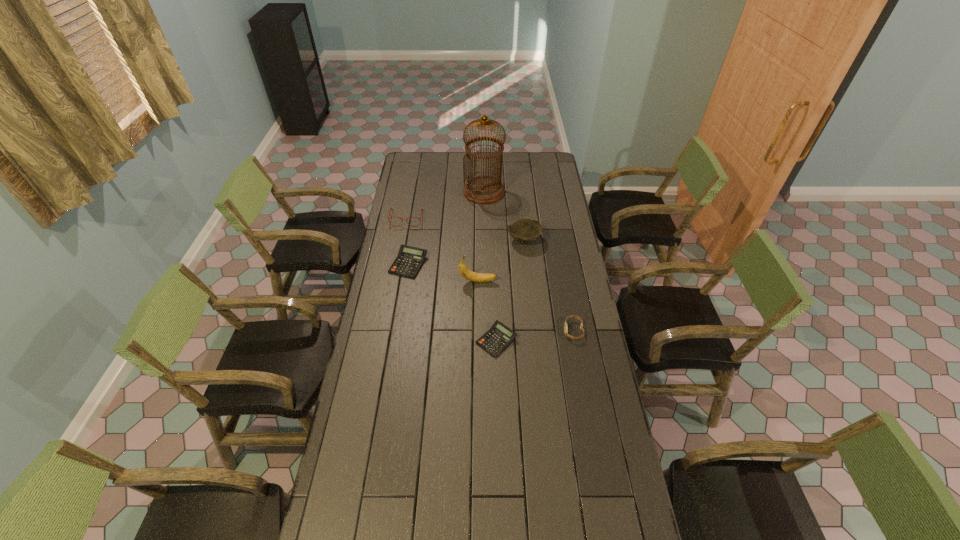
What are the coordinates of `calculator situated at the left edge` in the screenshot? It's located at (409, 260).

Find the location of a particular element. The height and width of the screenshot is (540, 960). spectacles that is at the left edge is located at coordinates (391, 208).

The height and width of the screenshot is (540, 960). I want to click on bowl that is at the right edge, so click(x=525, y=230).

Find the location of a particular element. The image size is (960, 540). watch that is at the right edge is located at coordinates (565, 325).

Identify the location of free space at the far edge of the desktop. (458, 168).

You are a GUI agent. You are given a task and a screenshot of the screen. Output one action in this format:
    pyautogui.click(x=<x>, y=<y>)
    Task: Click on the vacant space at the near edge of the desktop
    
    Given the screenshot: What is the action you would take?
    pyautogui.click(x=439, y=525)

This screenshot has height=540, width=960. I want to click on free space at the left edge, so click(x=359, y=376).

In the image, there is a desktop. In order to click on free space at the right edge in this screenshot , I will do `click(551, 194)`.

At what (x,y) coordinates should I click in order to perform the action: click on free space at the far left corner. Please return your answer as a coordinate pair (x, y). This screenshot has height=540, width=960. Looking at the image, I should click on (409, 160).

Identify the location of vacant space at the far right corner of the desktop. (545, 172).